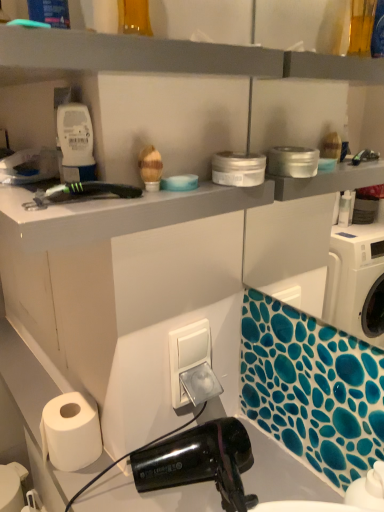
Question: Should I look upward or downward to see gray matte shelf at upper center?

Choices:
 (A) up
 (B) down

Answer: (A)

Question: Is the depth of gray matte shelf at upper center less than that of white matte paper towel at lower left?

Choices:
 (A) yes
 (B) no

Answer: (A)

Question: Considering the relative sizes of gray matte shelf at upper center and white matte paper towel at lower left in the image provided, is gray matte shelf at upper center taller than white matte paper towel at lower left?

Choices:
 (A) yes
 (B) no

Answer: (B)

Question: Is gray matte shelf at upper center to the left of white matte paper towel at lower left from the viewer's perspective?

Choices:
 (A) no
 (B) yes

Answer: (B)

Question: Considering the relative sizes of gray matte shelf at upper center and white matte paper towel at lower left in the image provided, is gray matte shelf at upper center thinner than white matte paper towel at lower left?

Choices:
 (A) no
 (B) yes

Answer: (A)

Question: Is gray matte shelf at upper center further to camera compared to white matte paper towel at lower left?

Choices:
 (A) yes
 (B) no

Answer: (B)

Question: From a real-world perspective, is gray matte shelf at upper center on white matte paper towel at lower left?

Choices:
 (A) yes
 (B) no

Answer: (A)

Question: Is gray matte shelf at upper center at the left side of white plastic switch at center?

Choices:
 (A) no
 (B) yes

Answer: (B)

Question: Is gray matte shelf at upper center positioned in front of white plastic switch at center?

Choices:
 (A) no
 (B) yes

Answer: (B)

Question: Is white plastic switch at center located within gray matte shelf at upper center?

Choices:
 (A) yes
 (B) no

Answer: (B)

Question: Is gray matte shelf at upper center bigger than white plastic switch at center?

Choices:
 (A) yes
 (B) no

Answer: (A)

Question: Is gray matte shelf at upper center oriented away from white plastic switch at center?

Choices:
 (A) no
 (B) yes

Answer: (A)

Question: Is gray matte shelf at upper center oriented towards white plastic switch at center?

Choices:
 (A) no
 (B) yes

Answer: (A)

Question: Considering the relative sizes of white matte paper towel at lower left and gray matte shelf at upper center in the image provided, is white matte paper towel at lower left bigger than gray matte shelf at upper center?

Choices:
 (A) no
 (B) yes

Answer: (A)